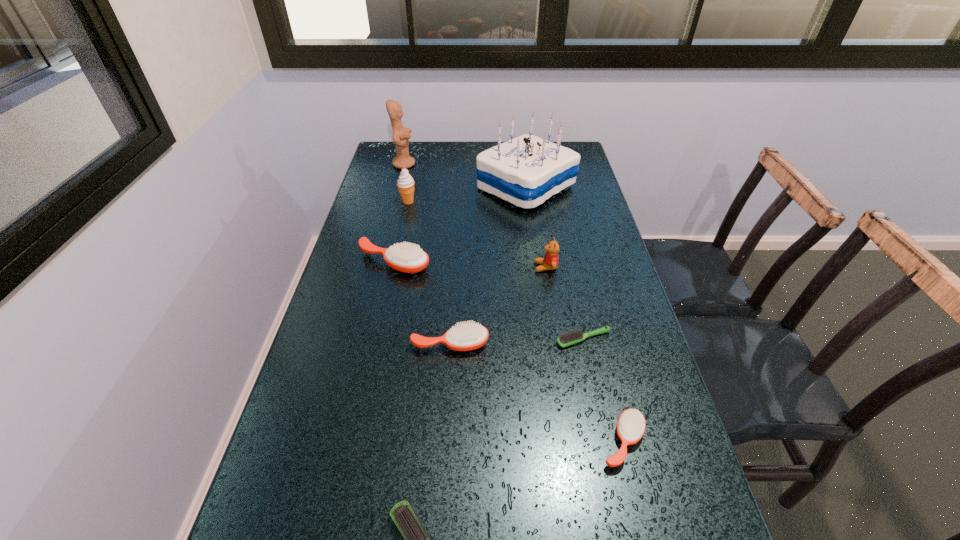
Image resolution: width=960 pixels, height=540 pixels. Identify the location of the rightmost orange hairbrush. (631, 424).

The width and height of the screenshot is (960, 540). In order to click on the eighth farthest object in this screenshot , I will do `click(631, 424)`.

The height and width of the screenshot is (540, 960). In order to click on the right light hairbrush in this screenshot , I will do `click(565, 340)`.

Locate an element on the screen. This screenshot has width=960, height=540. the smaller light hairbrush is located at coordinates tap(565, 340).

The height and width of the screenshot is (540, 960). Find the location of `free space located on the front-facing side of the figurine`. free space located on the front-facing side of the figurine is located at coordinates (495, 164).

This screenshot has width=960, height=540. Identify the location of vacant region located on the back of the blue birthday cake. (521, 154).

Image resolution: width=960 pixels, height=540 pixels. In order to click on vacant area situated on the back of the seventh shortest object in this screenshot , I will do `click(418, 156)`.

Find the location of a particular element. Image resolution: width=960 pixels, height=540 pixels. free location located 0.270m on the front-facing side of the red teddy bear is located at coordinates (438, 267).

The width and height of the screenshot is (960, 540). Identify the location of free point located 0.320m on the front-facing side of the red teddy bear. (420, 267).

The width and height of the screenshot is (960, 540). Identify the location of vacant space located on the front-facing side of the red teddy bear. (435, 267).